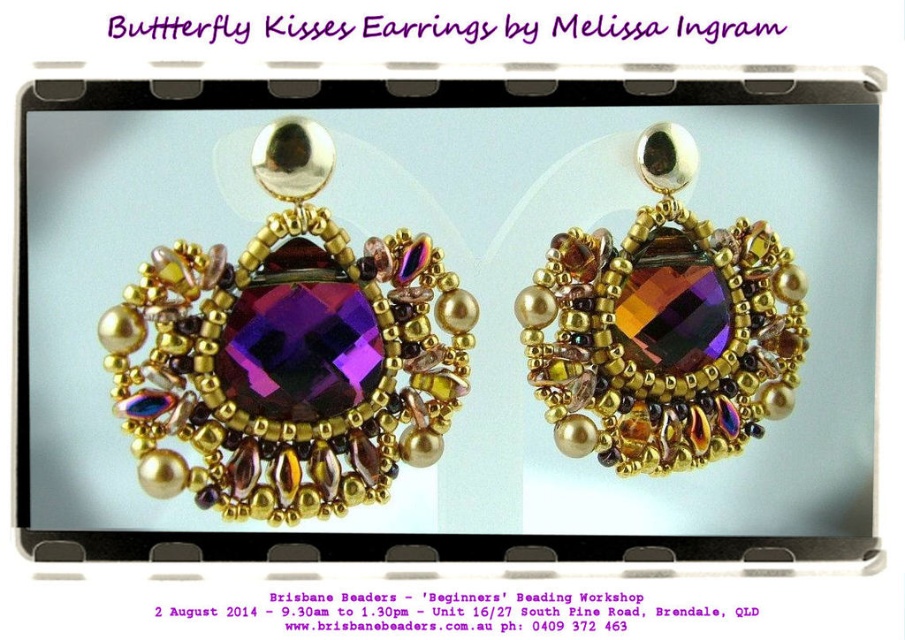
Based on the photo, what is located at the point with coordinates (289, 355) in the image of the Butterfly Kisses Earrings?

The point at coordinates (289, 355) marks the location of the purple faceted gemstone at center.

You are an appraiser examining the Butterfly Kisses Earrings. You notice two points marked on the earrings. Which point, point (260, 141) or point (579, 260), is closer to you?

Point (260, 141) is closer to the viewer than point (579, 260).